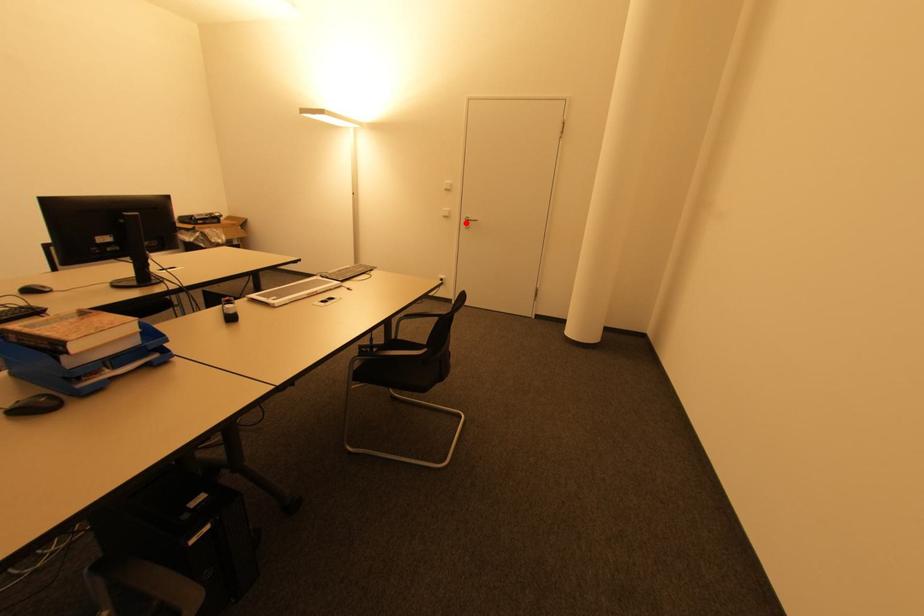
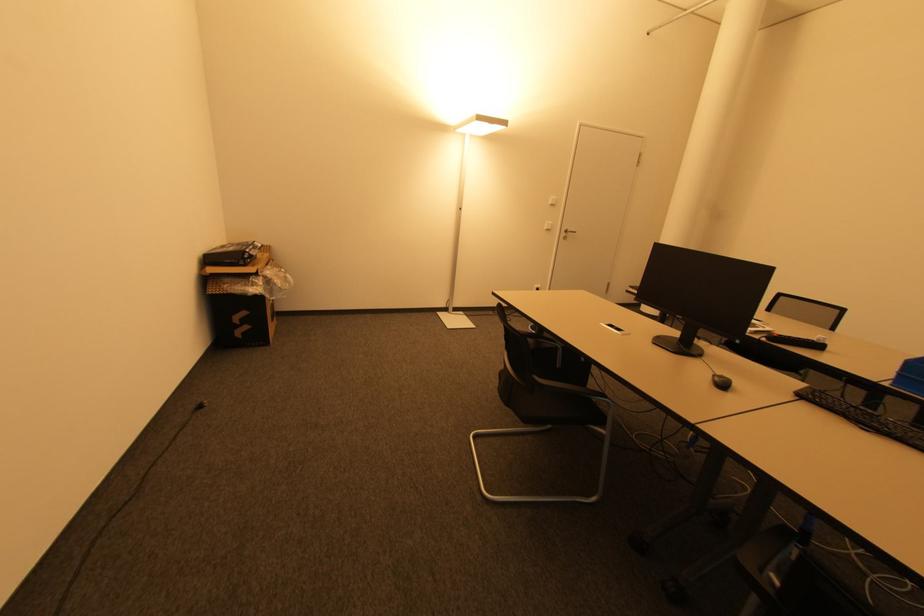
Locate, in the second image, the point that corresponds to the highlighted location in the first image.

(565, 235)